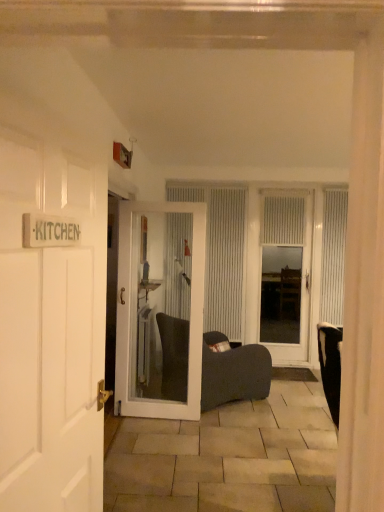
Where is `unoccupied area in front of white glossy door at center, placed as the second door when sorted from left to right`? The height and width of the screenshot is (512, 384). unoccupied area in front of white glossy door at center, placed as the second door when sorted from left to right is located at coordinates (172, 444).